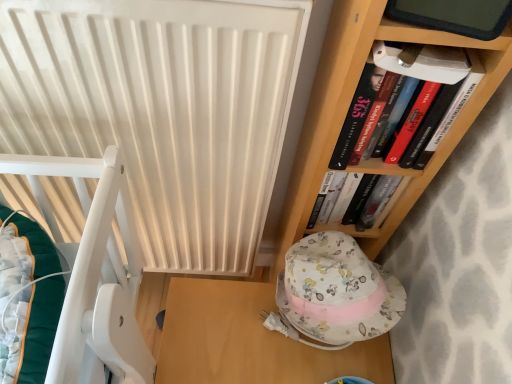
In order to face floral fabric hat at lower center, should I rotate leftwards or rightwards?

Turn right approximately 8.886 degrees to face it.

In order to face hardcover book at upper right, should I rotate leftwards or rightwards?

Rotate your view right by about 18.305°.

The height and width of the screenshot is (384, 512). Describe the element at coordinates (249, 340) in the screenshot. I see `wooden table at lower center` at that location.

Locate an element on the screen. This screenshot has height=384, width=512. floral fabric hat at lower center is located at coordinates (337, 291).

Which object is wider, hardcover book at upper right or floral fabric hat at lower center?

floral fabric hat at lower center is wider.

Between hardcover book at upper right and floral fabric hat at lower center, which one has smaller size?

hardcover book at upper right is smaller.

How different are the orientations of hardcover book at upper right and floral fabric hat at lower center in degrees?

85.1 degrees.

Relative to floral fabric hat at lower center, is hardcover book at upper right in front or behind?

hardcover book at upper right is positioned closer to the viewer than floral fabric hat at lower center.

Considering the positions of point (102, 24) and point (177, 333), is point (102, 24) closer or farther from the camera than point (177, 333)?

Point (102, 24).

Who is bigger, white matte radiator at center or wooden table at lower center?

white matte radiator at center.

From the image's perspective, is white matte radiator at center above or below wooden table at lower center?

Clearly, from the image's perspective, white matte radiator at center is above wooden table at lower center.

In the image, there is a wooden table at lower center. At what (x,y) coordinates should I click in order to perform the action: click on radiator above it (from the image's perspective). Please return your answer as a coordinate pair (x, y). The image size is (512, 384). Looking at the image, I should click on (161, 110).

Is hardcover book at upper right placed right next to wooden table at lower center?

hardcover book at upper right is not next to wooden table at lower center, and they're not touching.

From the image's perspective, is hardcover book at upper right located beneath wooden table at lower center?

No.

Which is correct: hardcover book at upper right is inside wooden table at lower center, or outside of it?

hardcover book at upper right lies outside wooden table at lower center.

In the image, is hardcover book at upper right on the left side or the right side of wooden table at lower center?

Based on their positions, hardcover book at upper right is located to the right of wooden table at lower center.

Considering the relative positions of white matte radiator at center and floral fabric hat at lower center in the image provided, is white matte radiator at center to the right of floral fabric hat at lower center from the viewer's perspective?

In fact, white matte radiator at center is to the left of floral fabric hat at lower center.

Does white matte radiator at center have a greater width compared to floral fabric hat at lower center?

Incorrect, the width of white matte radiator at center does not surpass that of floral fabric hat at lower center.

Is floral fabric hat at lower center inside white matte radiator at center?

No, floral fabric hat at lower center is located outside of white matte radiator at center.

Is white matte radiator at center facing towards floral fabric hat at lower center?

No, white matte radiator at center is not oriented towards floral fabric hat at lower center.

Is floral fabric hat at lower center facing towards white matte radiator at center?

→ No, floral fabric hat at lower center is not facing towards white matte radiator at center.

Is floral fabric hat at lower center next to white matte radiator at center and touching it?

floral fabric hat at lower center and white matte radiator at center are not in contact.

Based on their sizes in the image, would you say floral fabric hat at lower center is bigger or smaller than white matte radiator at center?

In the image, floral fabric hat at lower center appears to be smaller than white matte radiator at center.

How many degrees apart are the facing directions of floral fabric hat at lower center and hardcover book at upper right?

They differ by 85.1 degrees in their facing directions.

Is point (398, 306) closer to viewer compared to point (457, 91)?

No, (398, 306) is behind (457, 91).

From a real-world perspective, is floral fabric hat at lower center physically below hardcover book at upper right?

Yes, from a real-world perspective, floral fabric hat at lower center is under hardcover book at upper right.

Which object is closer to the camera taking this photo, floral fabric hat at lower center or hardcover book at upper right?

hardcover book at upper right is more forward.

Does wooden table at lower center come behind hardcover book at upper right?

Yes, it is behind hardcover book at upper right.

Is wooden table at lower center completely or partially outside of hardcover book at upper right?

Absolutely, wooden table at lower center is external to hardcover book at upper right.

Which of these two, wooden table at lower center or hardcover book at upper right, stands taller?

wooden table at lower center is taller.

Image resolution: width=512 pixels, height=384 pixels. What are the coordinates of `book above the floral fabric hat at lower center (from a real-world perspective)` in the screenshot? It's located at (391, 88).

This screenshot has width=512, height=384. I want to click on table that appears below the white matte radiator at center (from the image's perspective), so click(249, 340).

Considering their positions, is white matte radiator at center positioned further to wooden table at lower center than hardcover book at upper right?

hardcover book at upper right is further to wooden table at lower center.

Estimate the real-world distances between objects in this image. Which object is further from floral fabric hat at lower center, hardcover book at upper right or white matte radiator at center?

white matte radiator at center.

Estimate the real-world distances between objects in this image. Which object is further from hardcover book at upper right, wooden table at lower center or white matte radiator at center?

wooden table at lower center is further to hardcover book at upper right.

Estimate the real-world distances between objects in this image. Which object is closer to hardcover book at upper right, floral fabric hat at lower center or wooden table at lower center?

Among the two, floral fabric hat at lower center is located nearer to hardcover book at upper right.

Based on their spatial positions, is white matte radiator at center or floral fabric hat at lower center closer to hardcover book at upper right?

The object closer to hardcover book at upper right is floral fabric hat at lower center.

From the image, which object appears to be nearer to white matte radiator at center, floral fabric hat at lower center or hardcover book at upper right?

floral fabric hat at lower center is closer to white matte radiator at center.

When comparing their distances from wooden table at lower center, does hardcover book at upper right or white matte radiator at center seem closer?

The object closer to wooden table at lower center is white matte radiator at center.

Which object lies nearer to the anchor point white matte radiator at center, hardcover book at upper right or wooden table at lower center?

Based on the image, hardcover book at upper right appears to be nearer to white matte radiator at center.

This screenshot has width=512, height=384. Identify the location of radiator between hardcover book at upper right and wooden table at lower center in the up-down direction. (161, 110).

Identify the location of hat between white matte radiator at center and wooden table at lower center vertically. This screenshot has height=384, width=512. (337, 291).

Find the location of a particular element. This screenshot has width=512, height=384. hat between hardcover book at upper right and wooden table at lower center in the up-down direction is located at coordinates (337, 291).

This screenshot has height=384, width=512. Find the location of `hat between white matte radiator at center and hardcover book at upper right`. hat between white matte radiator at center and hardcover book at upper right is located at coordinates (337, 291).